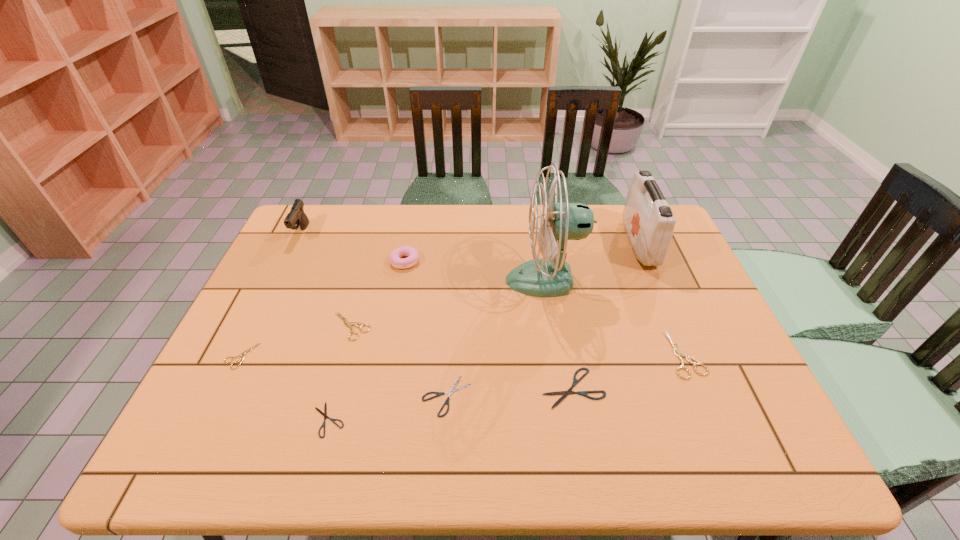
Image resolution: width=960 pixels, height=540 pixels. Identify the location of vacant space located 0.340m in front of the fan, directing airflow. (392, 280).

Identify the location of free spot located 0.160m in front of the fan, directing airflow. Image resolution: width=960 pixels, height=540 pixels. (452, 280).

Where is `vacant area located in front of the fan, directing airflow`? This screenshot has height=540, width=960. vacant area located in front of the fan, directing airflow is located at coordinates [x=432, y=280].

Identify the location of vacant space located on the front side of the red first-aid kit. (574, 243).

What are the coordinates of `vacant point located on the front side of the red first-aid kit` in the screenshot? It's located at (532, 243).

Locate an element on the screen. The width and height of the screenshot is (960, 540). vacant point located 0.280m on the front side of the red first-aid kit is located at coordinates (544, 243).

Identify the location of vacant position located at the barrel of the black pistol. (249, 343).

Find the location of a particular element. The width and height of the screenshot is (960, 540). free space located 0.140m on the left of the sixth object from right to left is located at coordinates (346, 261).

The height and width of the screenshot is (540, 960). What are the coordinates of `free space located 0.320m on the left of the sixth shortest object` in the screenshot? It's located at (543, 354).

Where is `vacant space located 0.100m on the back of the fifth shortest shears`? The width and height of the screenshot is (960, 540). vacant space located 0.100m on the back of the fifth shortest shears is located at coordinates (362, 287).